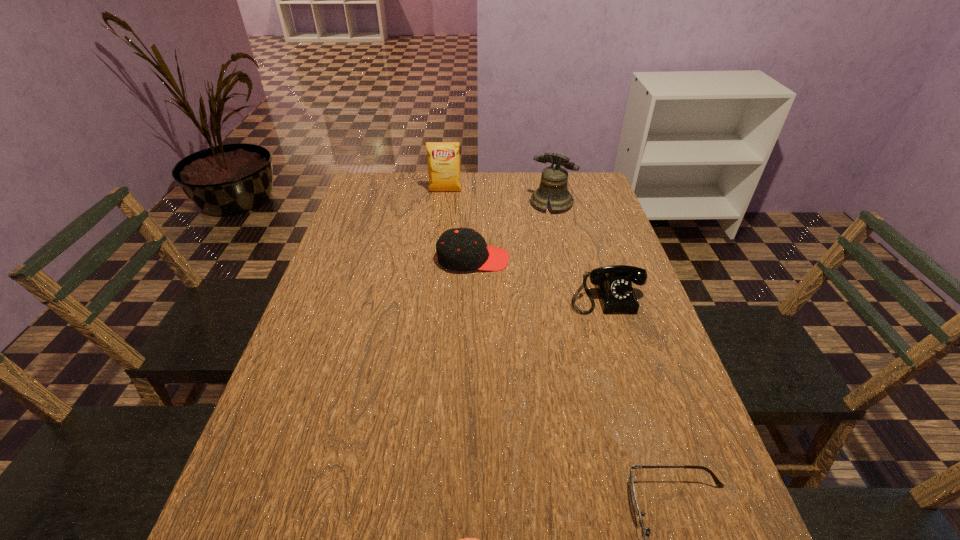
Find the location of a particular element. The height and width of the screenshot is (540, 960). free space between the telephone and the bell is located at coordinates (578, 248).

Identify the location of free space between the crisp (potato chip) and the bell. (498, 198).

Identify the location of free space between the crisp (potato chip) and the bell. The height and width of the screenshot is (540, 960). (498, 198).

Identify which object is located as the second nearest to the spectacles. Please provide its 2D coordinates. Your answer should be formatted as a tuple, i.e. [(x, y)], where the tuple contains the x and y coordinates of a point satisfying the conditions above.

[(613, 283)]

This screenshot has width=960, height=540. I want to click on object that is the third closest to the cap, so click(443, 158).